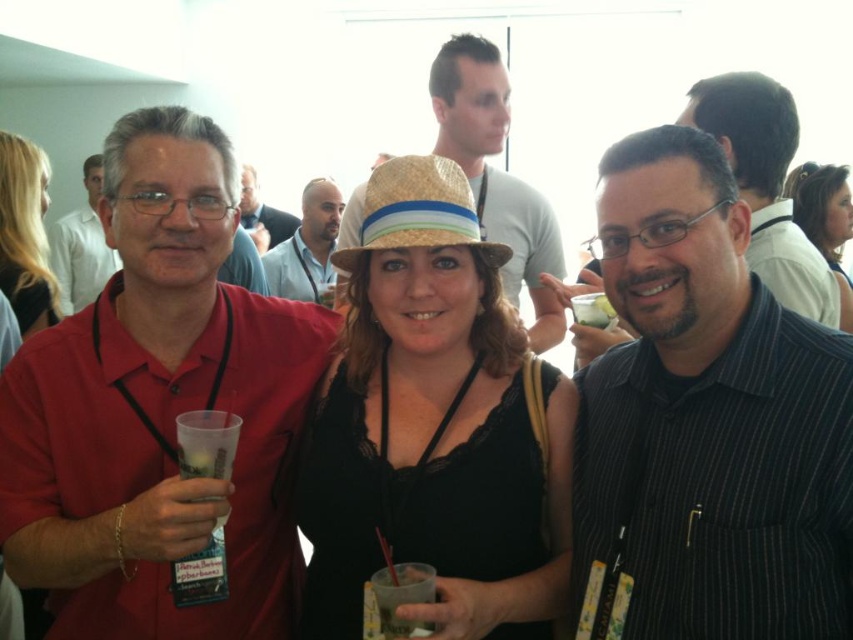
Question: Does black fabric dress at center have a greater width compared to clear plastic cup at center?

Choices:
 (A) yes
 (B) no

Answer: (A)

Question: Among these points, which one is nearest to the camera?

Choices:
 (A) (821, 289)
 (B) (38, 156)
 (C) (102, 241)

Answer: (A)

Question: Is natural straw hat at center wider than matte red shirt at center?

Choices:
 (A) yes
 (B) no

Answer: (A)

Question: Does translucent plastic cup at center have a smaller size compared to matte black shirt at upper center?

Choices:
 (A) no
 (B) yes

Answer: (B)

Question: Estimate the real-world distances between objects in this image. Which object is closer to the black fabric dress at center?

Choices:
 (A) matte straw hat at center
 (B) black striped shirt at center
 (C) matte black shirt at center
 (D) matte red shirt at left

Answer: (C)

Question: Which object is farther from the camera taking this photo?

Choices:
 (A) matte black shirt at center
 (B) matte black shirt at upper center

Answer: (B)